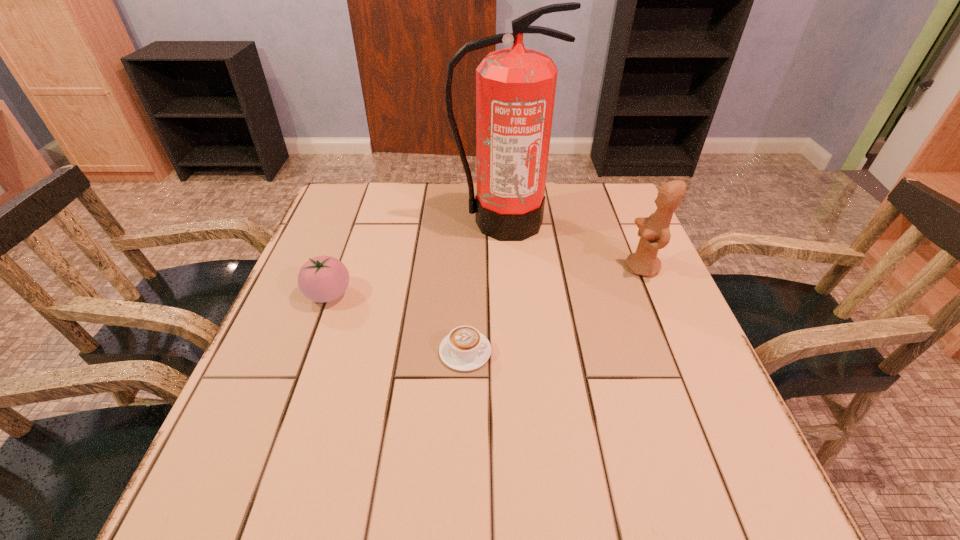
The height and width of the screenshot is (540, 960). Identify the location of vacant space at the right edge of the desktop. (599, 275).

Where is `vacant space at the far left corner of the desktop`? vacant space at the far left corner of the desktop is located at coordinates (x=380, y=209).

The image size is (960, 540). I want to click on vacant space at the near left corner, so click(x=231, y=471).

Where is `free point between the farthest object and the third shortest object`? free point between the farthest object and the third shortest object is located at coordinates (572, 245).

Where is `vacant region between the second tallest object and the tomato`? This screenshot has height=540, width=960. vacant region between the second tallest object and the tomato is located at coordinates (486, 281).

This screenshot has width=960, height=540. Identify the location of unoccupied position between the tallest object and the figurine. (572, 245).

I want to click on vacant region between the third shortest object and the third tallest object, so click(486, 281).

Find the location of a particular element. The width and height of the screenshot is (960, 540). unoccupied area between the rightmost object and the third tallest object is located at coordinates coord(486,281).

Find the location of a particular element. The width and height of the screenshot is (960, 540). free space between the tallest object and the shortest object is located at coordinates (484, 287).

The height and width of the screenshot is (540, 960). Identify the location of vacant area that lies between the third tallest object and the farthest object. tap(416, 258).